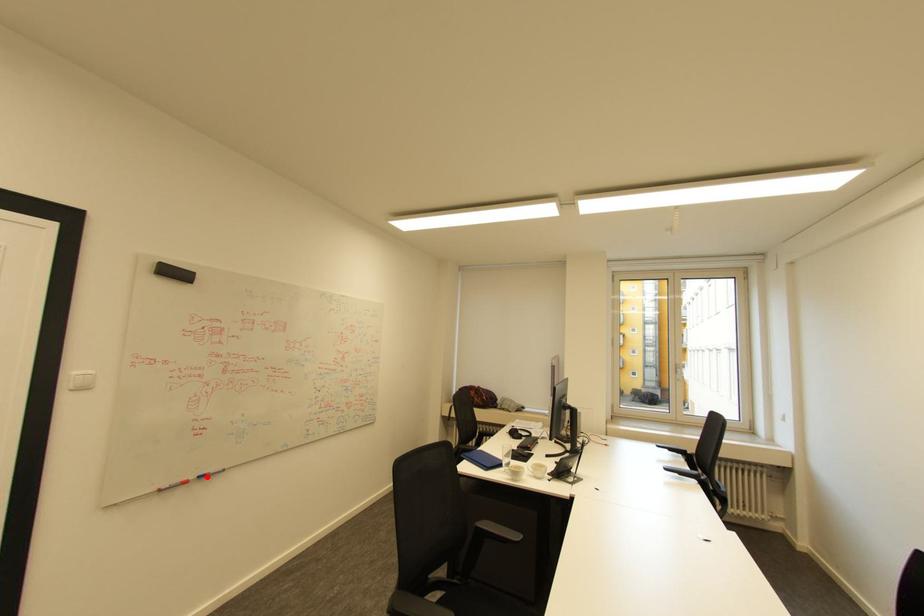
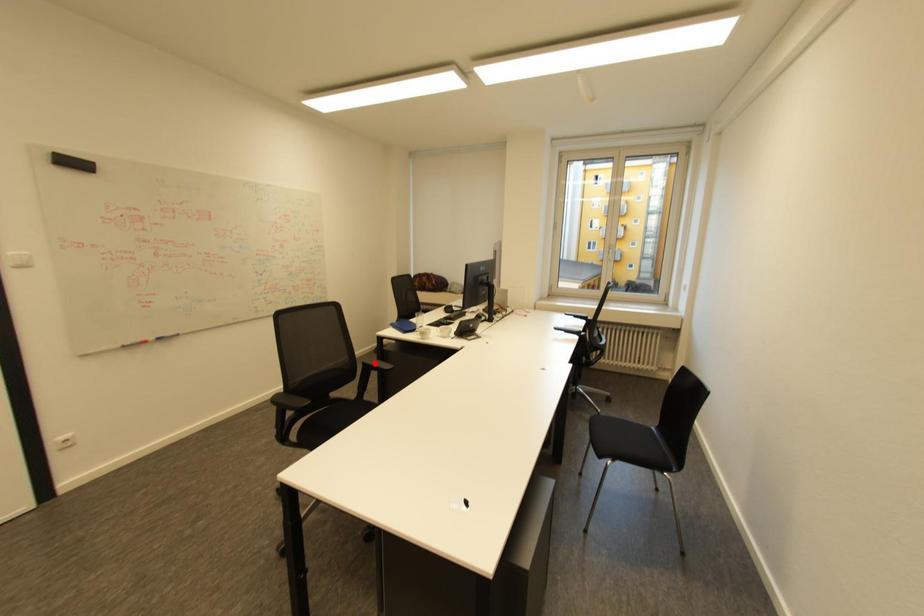
I am providing you with two images of the same scene from different viewpoints. A red point is marked on the first image and another point is marked on the second image. Do the highlighted points in image1 and image2 indicate the same real-world spot?

No